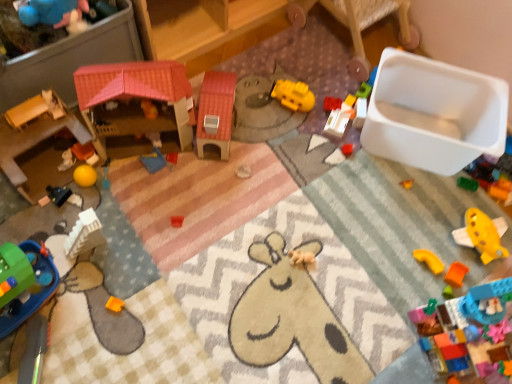
This screenshot has width=512, height=384. I want to click on free space behind white plastic container at center, marked as the 6th toy in a right-to-left arrangement, so click(x=333, y=94).